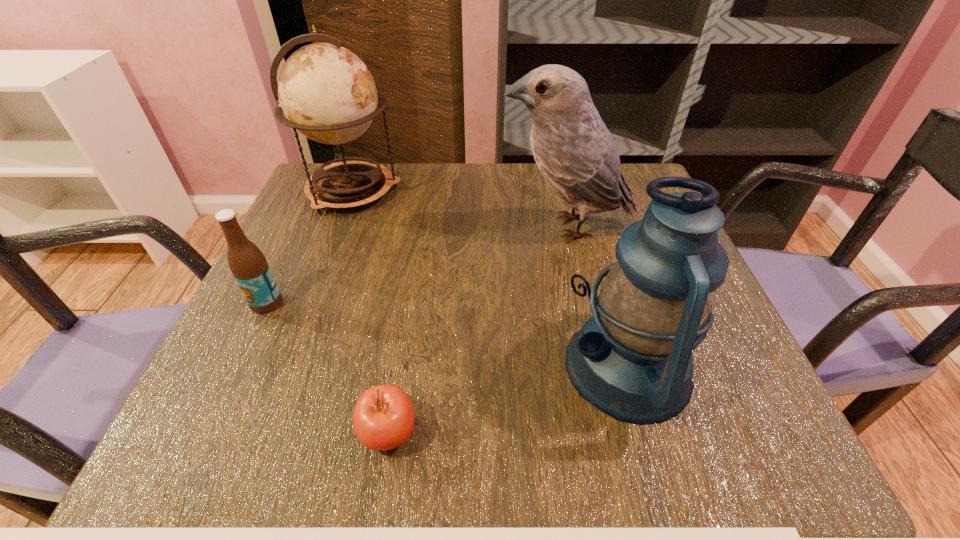
Where is `beer bottle situated at the left edge`? beer bottle situated at the left edge is located at coordinates [x=247, y=263].

The width and height of the screenshot is (960, 540). What are the coordinates of `parrot located in the right edge section of the desktop` in the screenshot? It's located at coord(575,152).

Locate an element on the screen. Image resolution: width=960 pixels, height=540 pixels. lantern situated at the right edge is located at coordinates (632, 359).

This screenshot has width=960, height=540. I want to click on object at the far left corner, so click(327, 93).

What are the coordinates of `object that is at the far right corner` in the screenshot? It's located at (575, 152).

The height and width of the screenshot is (540, 960). I want to click on object that is at the near right corner, so click(632, 359).

At what (x,y) coordinates should I click in order to perform the action: click on free space at the far edge of the desktop. Please return your answer as a coordinate pair (x, y). This screenshot has width=960, height=540. Looking at the image, I should click on (424, 165).

This screenshot has width=960, height=540. I want to click on blank area at the near edge, so click(556, 443).

This screenshot has height=540, width=960. What are the coordinates of `vacant space at the left edge of the desktop` in the screenshot? It's located at (x=258, y=368).

Where is `blank area at the right edge`? The image size is (960, 540). blank area at the right edge is located at coordinates (617, 241).